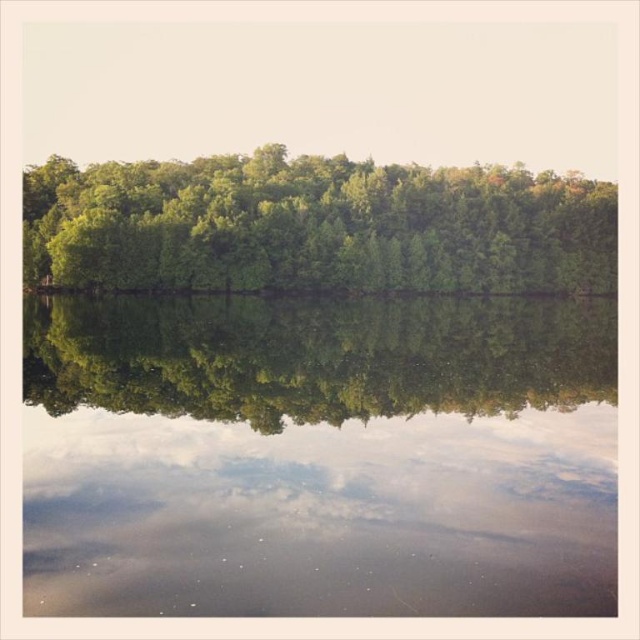
You are standing at the origin point of the coordinate system. You want to place a small boat on the transparent water at center. What are the coordinates where you should place the boat?

The coordinates for placing the boat on the transparent water at center are at point (320,456).

You are standing on a path near the water and want to walk to the green leafy trees at center. Can you step onto the transparent water at center to reach them?

The transparent water at center has a lesser width compared to green leafy trees at center. Since the water is transparent and part of the scene, you cannot step onto it to reach the trees as they are at the center but the water is a surface you can walk on. Wait, the answer might need correction. Let me think again. The question is about walking to the trees by stepping on the water. The objects description says the water has lesser width than the trees. Hmm, perhaps the trees are wider, so the water is a

You are standing at the center of the landscape and see two points marked in the image. The first point is labeled as point (83, 579) and the second is point (252, 272). Which point is closer to you?

Point (83, 579) is in front of point (252, 272), so it is closer to you.